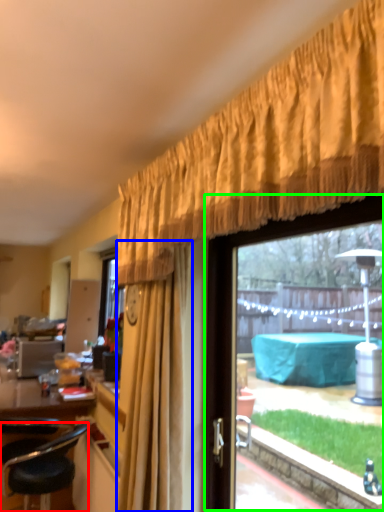
Question: Based on their relative distances, which object is farther from chair (highlighted by a red box)? Choose from curtain (highlighted by a blue box) and window (highlighted by a green box).

Choices:
 (A) curtain
 (B) window

Answer: (B)